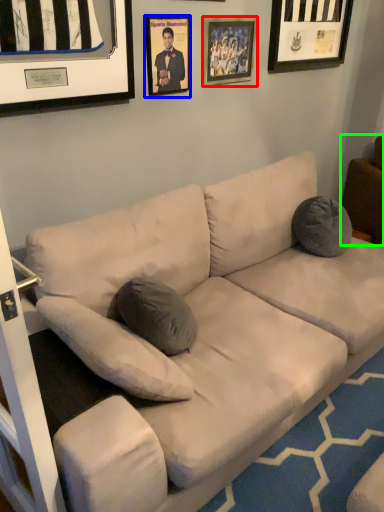
Question: Which object is the closest to the picture frame (highlighted by a red box)? Choose among these: picture frame (highlighted by a blue box) or furniture (highlighted by a green box).

Choices:
 (A) picture frame
 (B) furniture

Answer: (A)